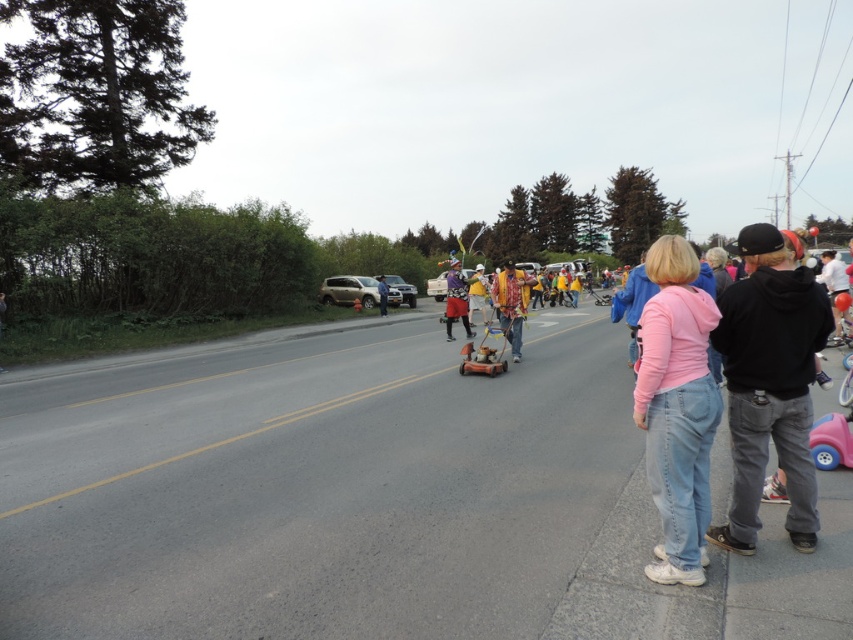
Question: Is pink cotton shirt at center positioned at the back of wooden baby carriage at center?

Choices:
 (A) yes
 (B) no

Answer: (B)

Question: Which point is farther to the camera?

Choices:
 (A) flannel shirt at center
 (B) matte black lawn mower at center
 (C) denim jacket at center
 (D) gray asphalt road at center

Answer: (C)

Question: Observing the image, what is the correct spatial positioning of gray asphalt road at center in reference to black matte balloon at right?

Choices:
 (A) right
 (B) left

Answer: (B)

Question: Which object appears farthest from the camera in this image?

Choices:
 (A) satin silver suv at center
 (B) denim jacket at center
 (C) matte black lawn mower at center
 (D) pink fleece jacket at center

Answer: (A)

Question: Which is nearer to the matte black lawn mower at center?

Choices:
 (A) pink fleece jacket at center
 (B) gray asphalt road at center
 (C) wooden baby carriage at center
 (D) metallic silver car at center

Answer: (B)

Question: Is yellow fabric at center positioned behind matte black lawn mower at center?

Choices:
 (A) yes
 (B) no

Answer: (A)